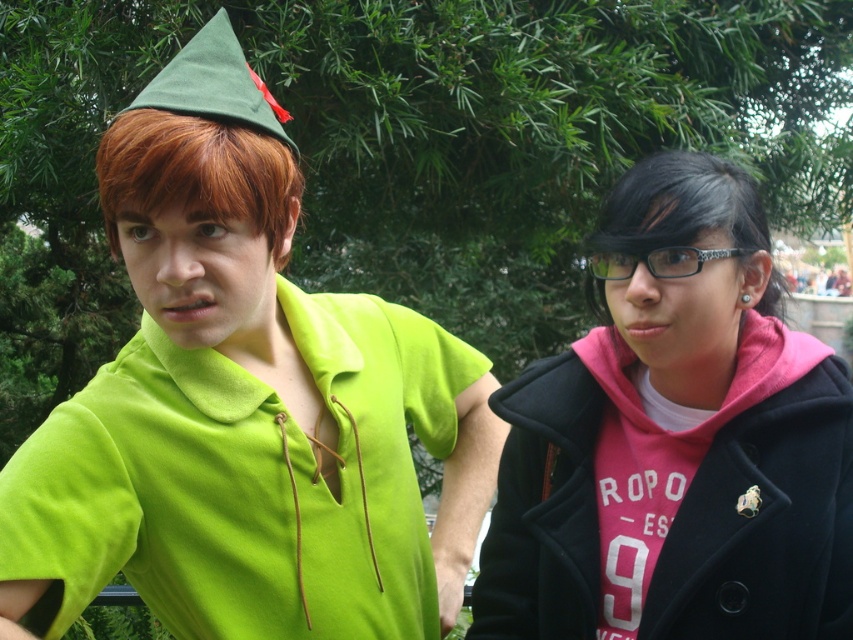
Based on the photo, you are a photographer trying to capture a photo of the reddish brown silky hair at left and the matte green shirt at center. You want to ensure both are visible in the frame. Based on their positions, which object should you focus on first to get both in the shot?

The matte green shirt at center is to the right of the reddish brown silky hair at left, so you should focus on the reddish brown silky hair at left first to ensure both are in the frame.

You are a photographer trying to capture a photo of the matte green shirt at center and the pink fleece hoodie at right. Since you want both subjects to be in focus, you need to adjust your camera settings. Which subject should you focus on to ensure both are sharp?

You should focus on the matte green shirt at center because it is located above the pink fleece hoodie at right, so focusing on the front subject ensures both are in focus.

You are a photographer trying to capture the reddish brown silky hair at left and the black jacket over pink hoodie with white text ROPO ES 9 at right. Based on their positions, which object is closer to the center of the image?

The reddish brown silky hair at left is located at point (196, 173), which is closer to the center of the image compared to the black jacket over pink hoodie with white text ROPO ES 9 at right.